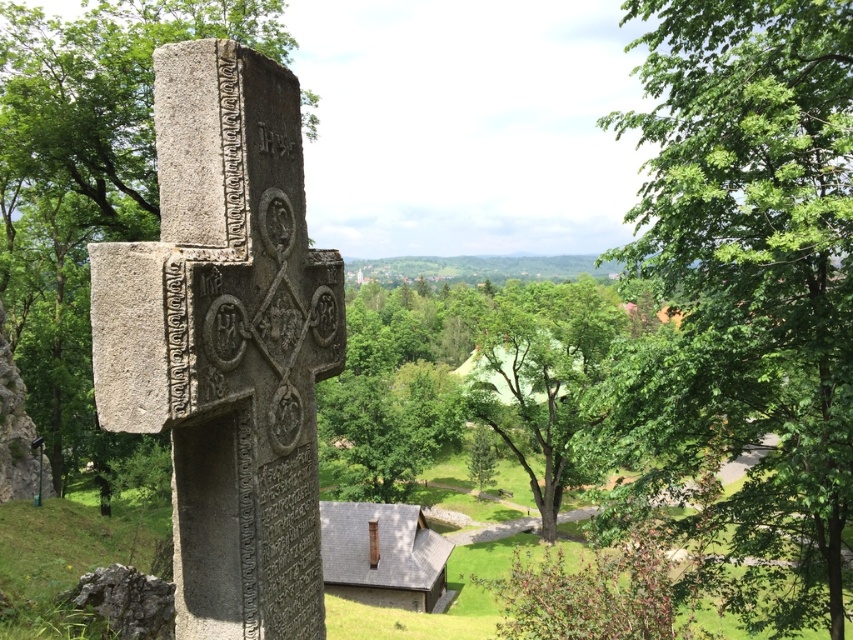
Is green leafy tree at center to the right of green stone cross at center from the viewer's perspective?

Yes, green leafy tree at center is to the right of green stone cross at center.

Find the location of a particular element. The width and height of the screenshot is (853, 640). green leafy tree at center is located at coordinates (751, 276).